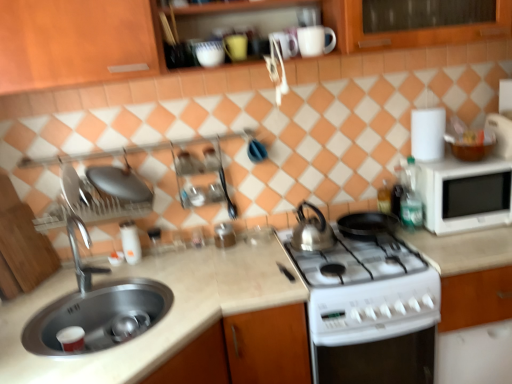
At what (x,y) coordinates should I click in order to perform the action: click on free space in front of green glass bottle at right, the second bottle positioned from the back. Please return your answer as a coordinate pair (x, y). Image resolution: width=512 pixels, height=384 pixels. Looking at the image, I should click on (445, 243).